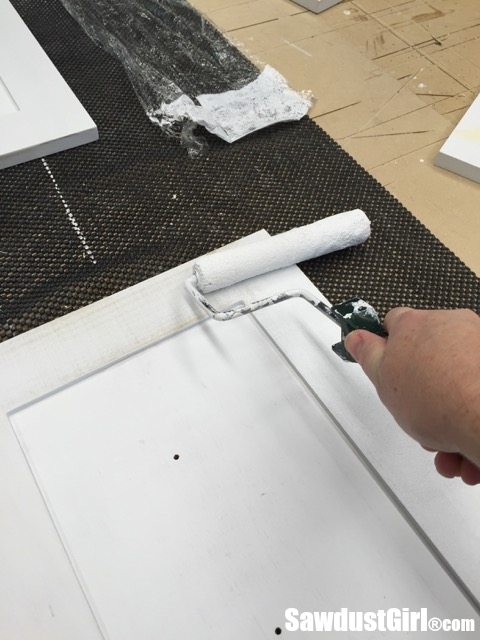
At what (x,y) coordinates should I click in order to perform the action: click on door. Please return your answer as a coordinate pair (x, y). Image resolution: width=480 pixels, height=640 pixels. Looking at the image, I should click on (242, 564).